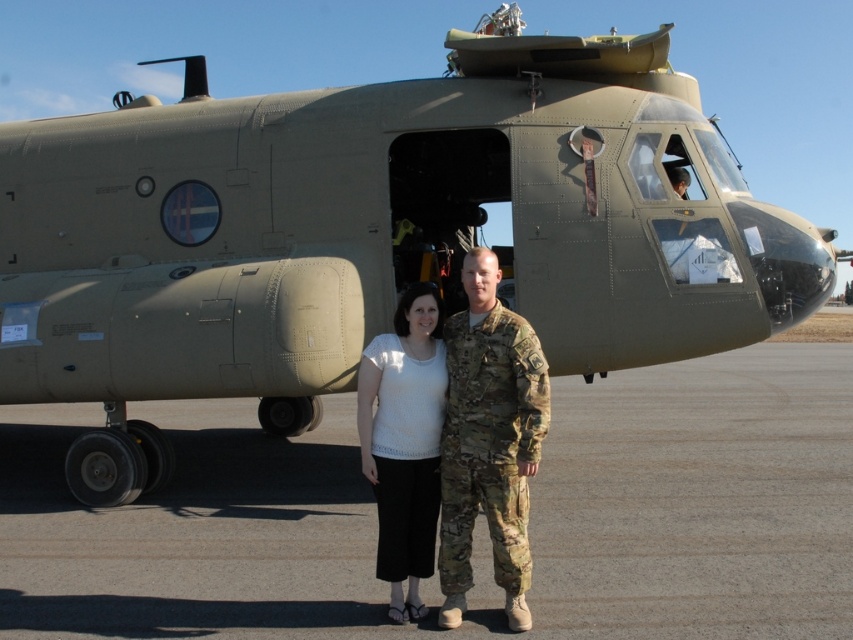
Is gray asphalt at center bigger than camouflage uniform at center?

→ Indeed, gray asphalt at center has a larger size compared to camouflage uniform at center.

Measure the distance between point [328,461] and camera.

A distance of 30.82 feet exists between point [328,461] and camera.

Locate an element on the screen. This screenshot has height=640, width=853. gray asphalt at center is located at coordinates (699, 499).

Between camouflage uniform at center and white knit top at center, which one appears on the right side from the viewer's perspective?

From the viewer's perspective, camouflage uniform at center appears more on the right side.

What are the coordinates of `camouflage uniform at center` in the screenshot? It's located at (489, 440).

Who is higher up, gray asphalt at center or white knit top at center?

white knit top at center is above.

Based on the photo, is gray asphalt at center shorter than white knit top at center?

Correct, gray asphalt at center is not as tall as white knit top at center.

Between point (846, 548) and point (413, 445), which one is positioned in front?

Point (413, 445)

The height and width of the screenshot is (640, 853). In order to click on gray asphalt at center in this screenshot , I will do `click(699, 499)`.